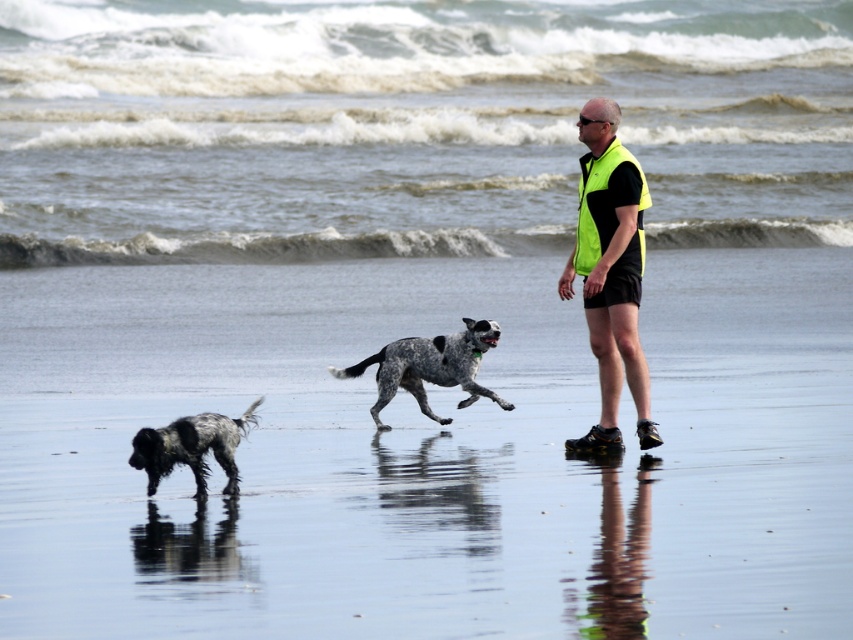
Identify the location of shiny wet sand at center. Image resolution: width=853 pixels, height=640 pixels. (428, 454).

Does point (170, 582) come closer to viewer compared to point (329, 368)?

Yes, it is in front of point (329, 368).

Describe the element at coordinates (428, 454) in the screenshot. I see `shiny wet sand at center` at that location.

Locate an element on the screen. The width and height of the screenshot is (853, 640). shiny wet sand at center is located at coordinates (428, 454).

Between shiny wet sand at center and spotted fur dog at lower left, which one appears on the right side from the viewer's perspective?

Positioned to the right is shiny wet sand at center.

Is shiny wet sand at center to the right of spotted fur dog at lower left from the viewer's perspective?

Correct, you'll find shiny wet sand at center to the right of spotted fur dog at lower left.

The width and height of the screenshot is (853, 640). What are the coordinates of `shiny wet sand at center` in the screenshot? It's located at (428, 454).

You are a GUI agent. You are given a task and a screenshot of the screen. Output one action in this format:
    pyautogui.click(x=<x>, y=<y>)
    Task: Click on the shiny wet sand at center
    Image resolution: width=853 pixels, height=640 pixels.
    Given the screenshot: What is the action you would take?
    pyautogui.click(x=428, y=454)

Which is above, shiny wet sand at center or neon yellow vest at center?

neon yellow vest at center

Does shiny wet sand at center appear on the right side of neon yellow vest at center?

In fact, shiny wet sand at center is to the left of neon yellow vest at center.

I want to click on shiny wet sand at center, so click(x=428, y=454).

The width and height of the screenshot is (853, 640). I want to click on shiny wet sand at center, so click(428, 454).